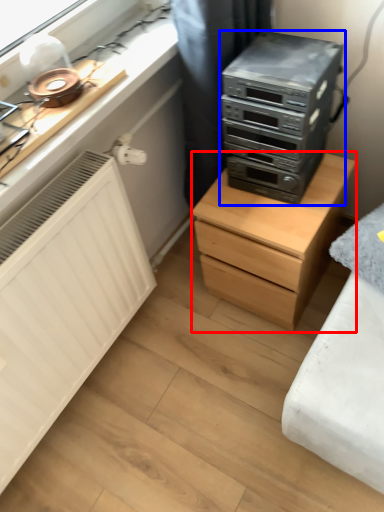
Question: Which object is further to the camera taking this photo, chest of drawers (highlighted by a red box) or home appliance (highlighted by a blue box)?

Choices:
 (A) chest of drawers
 (B) home appliance

Answer: (A)